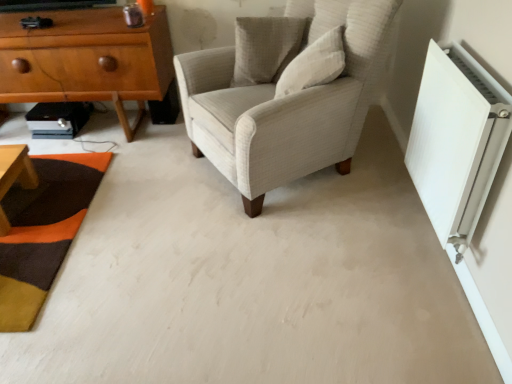
Question: Considering the positions of light brown wood chest of drawers at left and white plastic radiator at right in the image, is light brown wood chest of drawers at left taller or shorter than white plastic radiator at right?

Choices:
 (A) tall
 (B) short

Answer: (A)

Question: Choose the correct answer: Is light brown wood chest of drawers at left inside white plastic radiator at right or outside it?

Choices:
 (A) inside
 (B) outside

Answer: (B)

Question: Which object is the farthest from the light beige fabric armchair at center?

Choices:
 (A) white plastic radiator at right
 (B) light brown wood chest of drawers at left
 (C) white cotton pillow at upper center, the second pillow positioned from the back
 (D) textured wool mat at lower left
 (E) textured beige pillow at upper center, the 2th pillow positioned from the front

Answer: (D)

Question: Which of these objects is positioned closest to the light beige fabric armchair at center?

Choices:
 (A) textured beige pillow at upper center, positioned as the first pillow in back-to-front order
 (B) white cotton pillow at upper center, the second pillow positioned from the back
 (C) light brown wood chest of drawers at left
 (D) textured wool mat at lower left
 (E) white plastic radiator at right

Answer: (B)